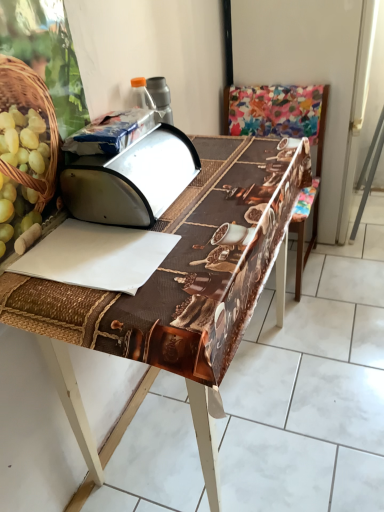
Where is `empty space that is to the right of brown woven table at center`? empty space that is to the right of brown woven table at center is located at coordinates (337, 357).